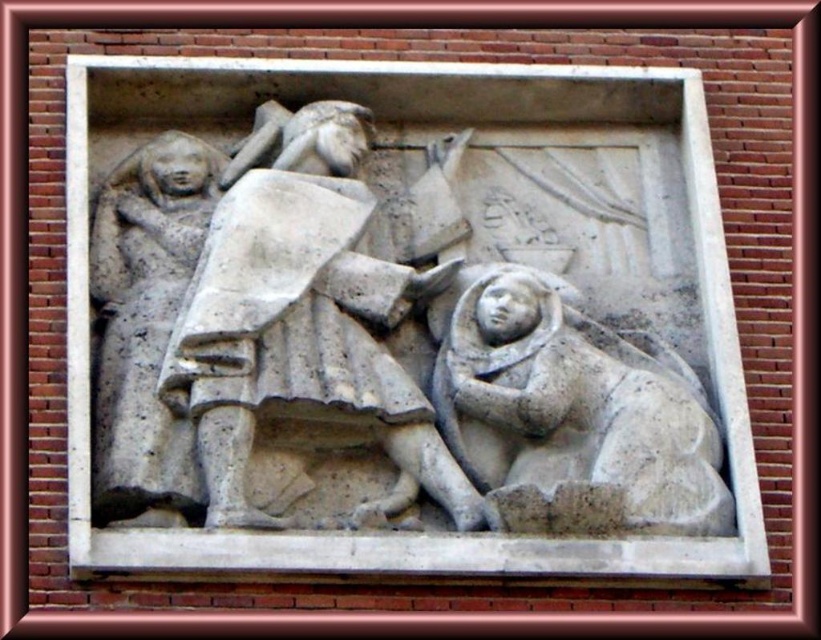
Question: Observing the image, what is the correct spatial positioning of white stone figure at center in reference to smooth stone figure at left?

Choices:
 (A) below
 (B) above

Answer: (B)

Question: Is white stone figure at center closer to camera compared to smooth stone figure at left?

Choices:
 (A) yes
 (B) no

Answer: (A)

Question: Is gray stone figure at lower right below smooth stone figure at left?

Choices:
 (A) no
 (B) yes

Answer: (B)

Question: Among these points, which one is farthest from the camera?

Choices:
 (A) (287, 330)
 (B) (695, 500)

Answer: (A)

Question: Among these objects, which one is farthest from the camera?

Choices:
 (A) smooth stone figure at left
 (B) gray stone figure at lower right

Answer: (A)

Question: Which object is farther from the camera taking this photo?

Choices:
 (A) white stone figure at center
 (B) gray stone figure at lower right
 (C) smooth stone figure at left

Answer: (C)